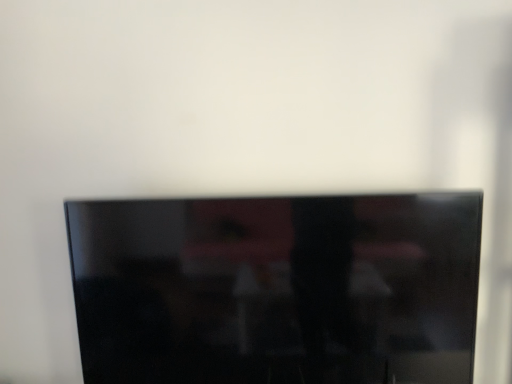
What do you see at coordinates (277, 289) in the screenshot? I see `matte black tv at center` at bounding box center [277, 289].

Locate an element on the screen. Image resolution: width=512 pixels, height=384 pixels. matte black tv at center is located at coordinates (277, 289).

The width and height of the screenshot is (512, 384). Identify the location of matte black tv at center. (277, 289).